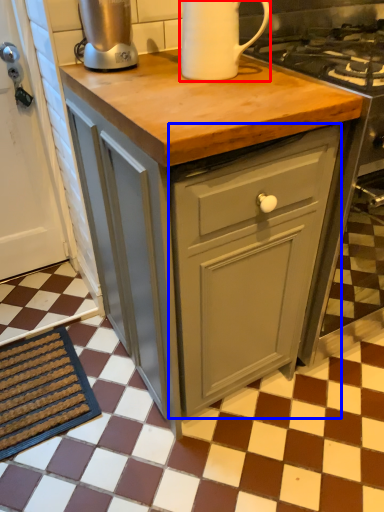
Question: Among these objects, which one is farthest to the camera, kitchen appliance (highlighted by a red box) or cabinetry (highlighted by a blue box)?

Choices:
 (A) kitchen appliance
 (B) cabinetry

Answer: (B)